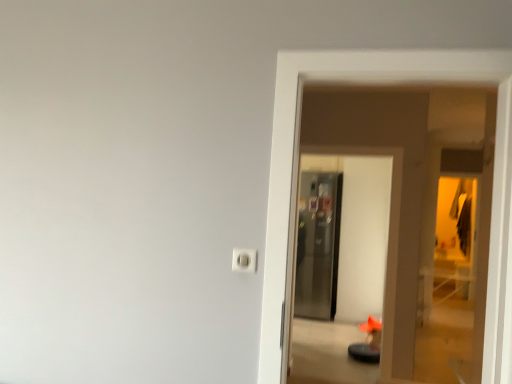
You are a GUI agent. You are given a task and a screenshot of the screen. Output one action in this format:
    pyautogui.click(x=<x>, y=<y>)
    Task: Click on the free region under satin metallic refrigerator at center, which is counted as the second screen door, starting from the back (from a real-world perspective)
    The image size is (512, 384).
    Given the screenshot: What is the action you would take?
    pyautogui.click(x=349, y=378)